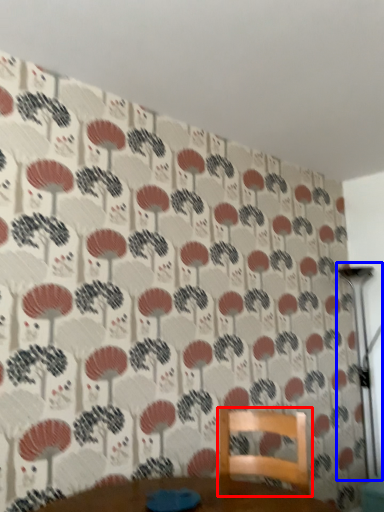
Question: Which object appears farthest to the camera in this image, furniture (highlighted by a red box) or table lamp (highlighted by a blue box)?

Choices:
 (A) furniture
 (B) table lamp

Answer: (B)